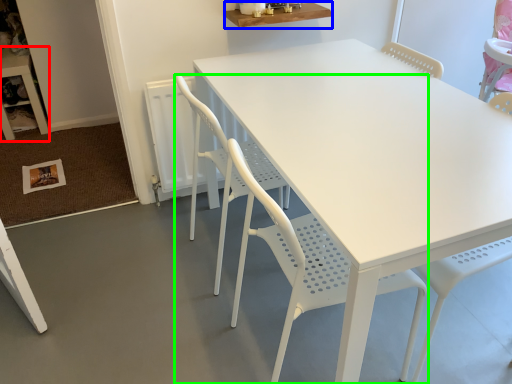
Question: Which object is the closest to the table (highlighted by a red box)? Choose among these: table (highlighted by a blue box) or chair (highlighted by a green box).

Choices:
 (A) table
 (B) chair

Answer: (A)